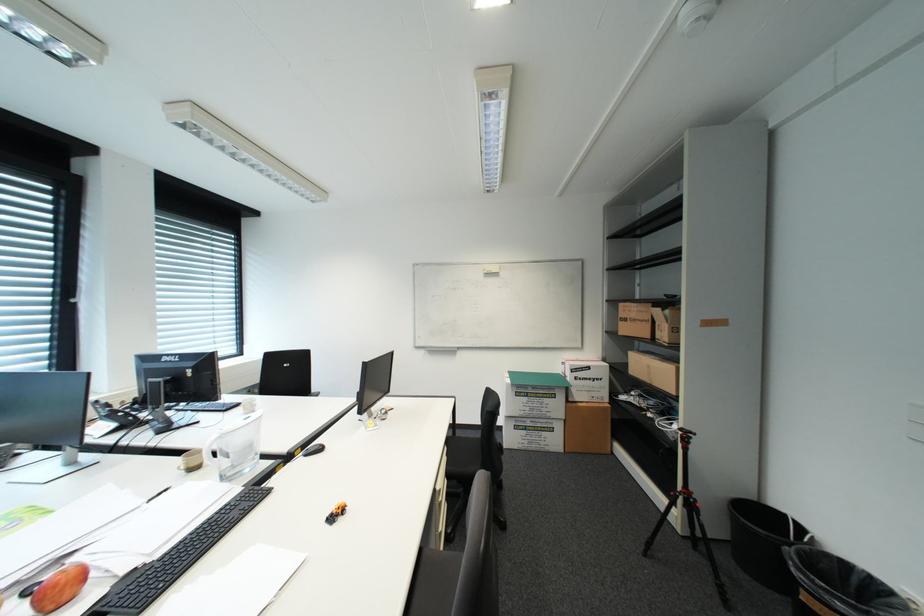
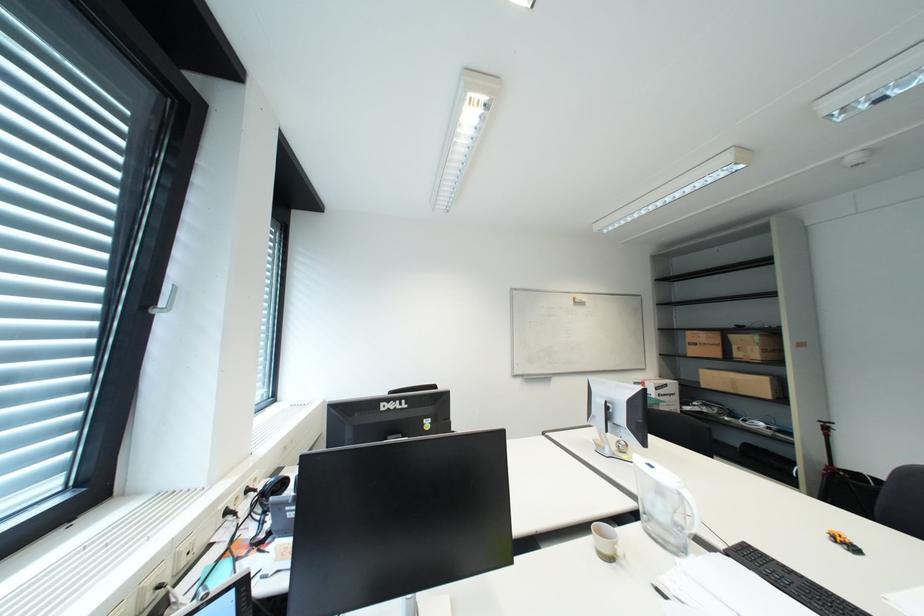
Question: Which direction would the cameraman need to move to produce the second image? Reply with the corresponding letter.

Choices:
 (A) Left
 (B) Right
 (C) Forward
 (D) Backward

Answer: (A)